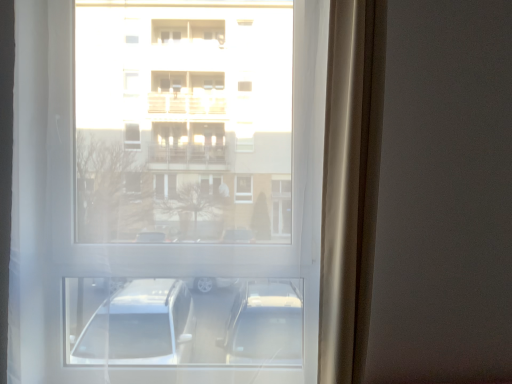
Image resolution: width=512 pixels, height=384 pixels. Describe the element at coordinates (350, 185) in the screenshot. I see `silky beige curtain at right` at that location.

This screenshot has height=384, width=512. In order to click on silky beige curtain at right in this screenshot , I will do `click(350, 185)`.

The height and width of the screenshot is (384, 512). Find the location of `silky beige curtain at right`. silky beige curtain at right is located at coordinates (350, 185).